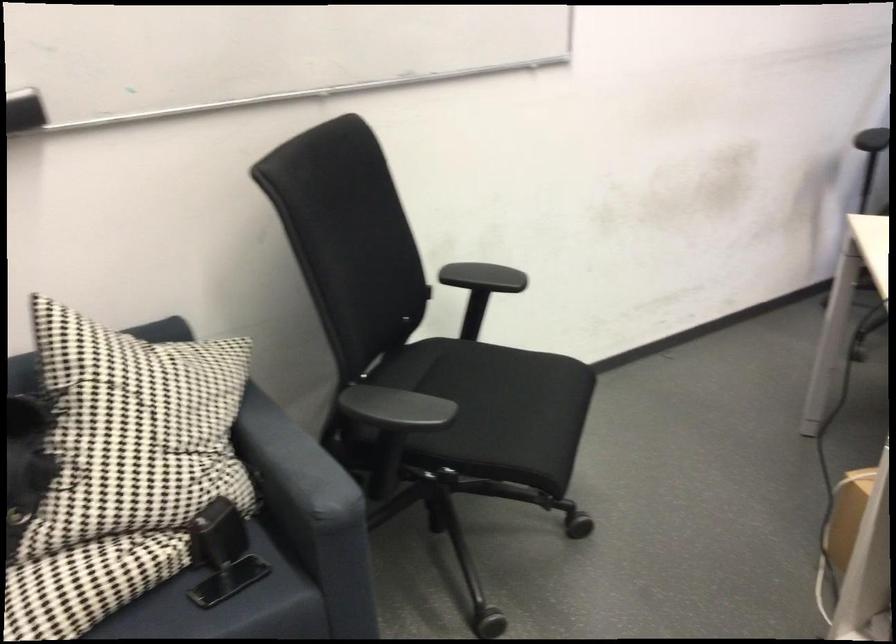
Identify the location of chair sitting surface. (495, 409).